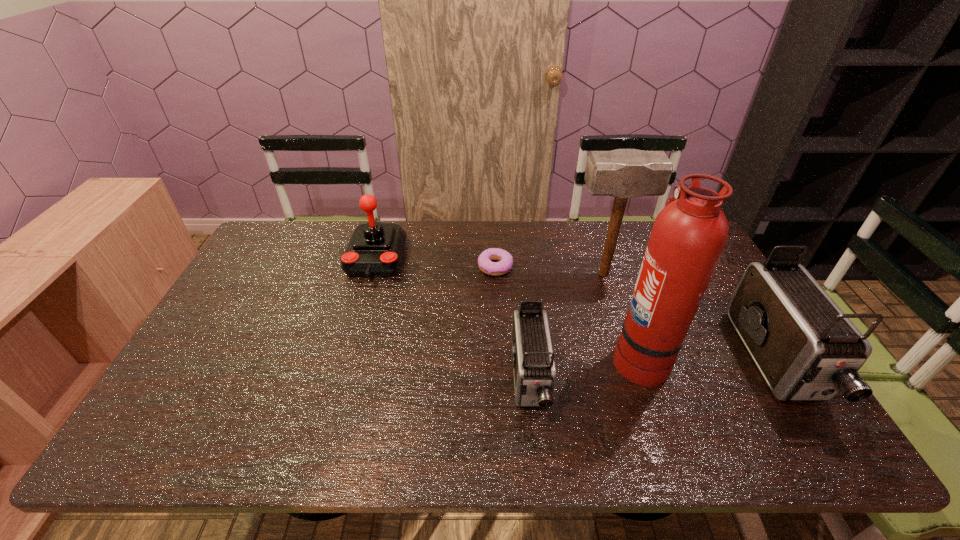
Please point a free position for a camcorder on the left. Please provide its 2D coordinates. Your answer should be formatted as a tuple, i.e. [(x, y)], where the tuple contains the x and y coordinates of a point satisfying the conditions above.

[(265, 398)]